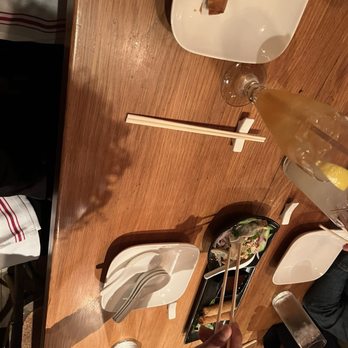
At what (x,y) coordinates should I click in order to perform the action: click on chopstick rest. Please return your answer as a coordinate pair (x, y). Looking at the image, I should click on (247, 125), (290, 210), (172, 311).